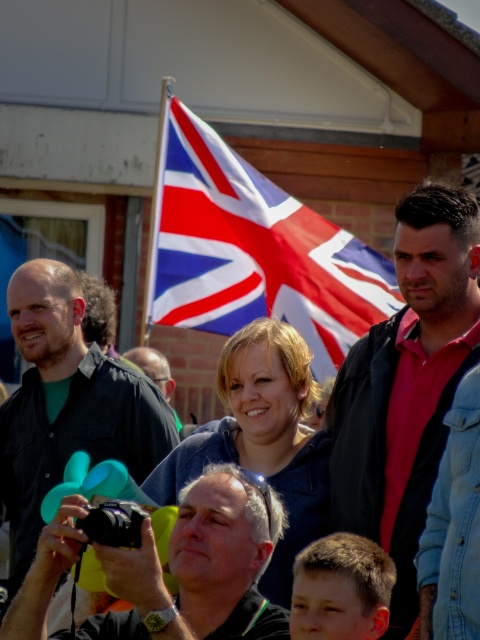
Question: Is red and white fabric flag at center above matte black camera at center?

Choices:
 (A) no
 (B) yes

Answer: (B)

Question: Which is farther from the matte black camera at center?

Choices:
 (A) denim jacket at right
 (B) matte black shirt at left

Answer: (B)

Question: Does denim jacket at right lie in front of matte black shirt at left?

Choices:
 (A) no
 (B) yes

Answer: (B)

Question: From the image, what is the correct spatial relationship of denim jacket at right in relation to matte black camera at center?

Choices:
 (A) left
 (B) right

Answer: (B)

Question: Which point appears closest to the camera in this image?

Choices:
 (A) (48, 307)
 (B) (396, 218)

Answer: (A)

Question: Which point appears farthest from the camera in this image?

Choices:
 (A) (215, 141)
 (B) (50, 420)
 (C) (228, 497)
 (D) (364, 429)

Answer: (A)